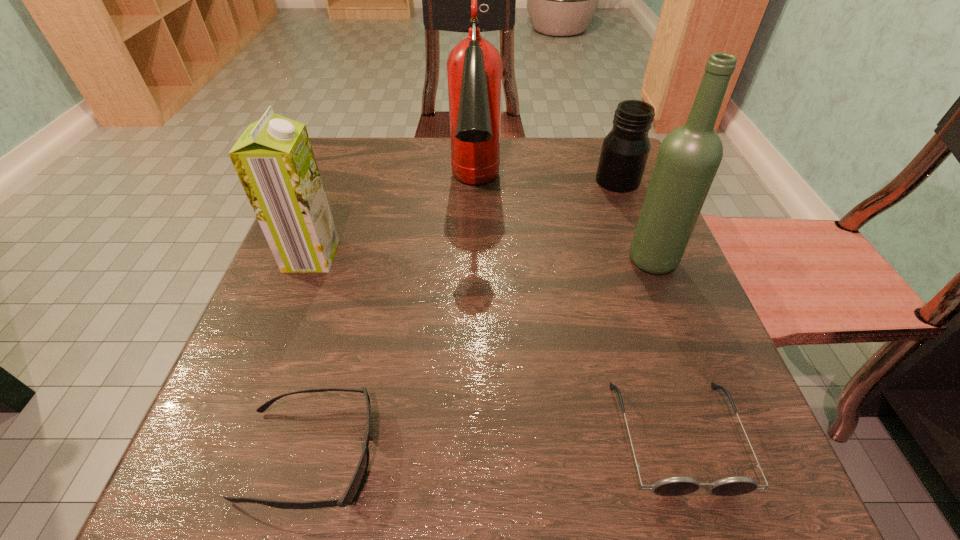
Find the location of a particular element. the fourth object from right to left is located at coordinates (474, 67).

At what (x,y) coordinates should I click in order to perform the action: click on wine bottle. Please return your answer as a coordinate pair (x, y). The image size is (960, 540). Looking at the image, I should click on (689, 156).

Where is `the fourth shortest object`? the fourth shortest object is located at coordinates (274, 160).

The image size is (960, 540). Identify the location of jar. (x=625, y=150).

Locate an element on the screen. Image resolution: width=960 pixels, height=540 pixels. the right sunglasses is located at coordinates (679, 485).

Locate an element on the screen. Image resolution: width=960 pixels, height=540 pixels. the left sunglasses is located at coordinates (352, 491).

The width and height of the screenshot is (960, 540). I want to click on vacant space located at the nozzle end of the fire extinguisher, so click(x=473, y=323).

This screenshot has height=540, width=960. Find the location of `free location located on the back of the wine bottle`. free location located on the back of the wine bottle is located at coordinates (623, 186).

The height and width of the screenshot is (540, 960). I want to click on vacant space situated on the right of the soya milk, so click(x=499, y=256).

This screenshot has width=960, height=540. I want to click on vacant position located 0.320m on the front of the third shortest object, so click(x=664, y=305).